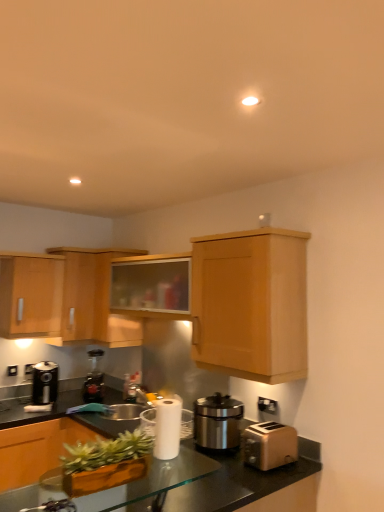
This screenshot has width=384, height=512. I want to click on translucent glass countertop at center, so pos(242,481).

The height and width of the screenshot is (512, 384). Describe the element at coordinates (269, 445) in the screenshot. I see `brown matte toaster at lower right` at that location.

Describe the element at coordinates (45, 383) in the screenshot. I see `black metallic coffee machine at left, the 1th coffee machine in the left-to-right sequence` at that location.

What do you see at coordinates (152, 285) in the screenshot? I see `wooden cabinet at upper center, which ranks as the 4th cabinetry in left-to-right order` at bounding box center [152, 285].

Find the location of a particular element. The width and height of the screenshot is (384, 512). wooden cabinet at upper center, which ranks as the 4th cabinetry in left-to-right order is located at coordinates point(152,285).

The image size is (384, 512). What do you see at coordinates (77, 293) in the screenshot? I see `wooden cabinet at upper left, which is counted as the fourth cabinetry, starting from the right` at bounding box center [77, 293].

Where is `translucent glass countertop at center`? translucent glass countertop at center is located at coordinates (242, 481).

From the image's perspective, which object appears higher, black plastic toaster at lower right or black metallic coffee machine at left, which is the 1th coffee machine in front-to-back order?

black plastic toaster at lower right, from the image's perspective.

Consider the image. Is black plastic toaster at lower right positioned with its back to black metallic coffee machine at left, the 1th coffee machine in the left-to-right sequence?

No, black metallic coffee machine at left, the 1th coffee machine in the left-to-right sequence, is not at the back of black plastic toaster at lower right.

Image resolution: width=384 pixels, height=512 pixels. Identify the location of the 2nd coffee machine below the black plastic toaster at lower right (from a real-world perspective). (45, 383).

Can you confirm if black plastic toaster at lower right is shorter than black metallic coffee machine at left, acting as the second coffee machine starting from the right?

Yes.

Is transparent glass table at lower center completely or partially inside wooden cabinet at upper center, which ranks as the 4th cabinetry in left-to-right order?

Definitely not — transparent glass table at lower center is not inside wooden cabinet at upper center, which ranks as the 4th cabinetry in left-to-right order.

From the image's perspective, relative to transparent glass table at lower center, is wooden cabinet at upper center, which ranks as the 4th cabinetry in left-to-right order, above or below?

From the image's perspective, wooden cabinet at upper center, which ranks as the 4th cabinetry in left-to-right order, appears above transparent glass table at lower center.

Is wooden cabinet at upper center, which ranks as the 4th cabinetry in left-to-right order, looking in the opposite direction of transparent glass table at lower center?

No.

Considering the sizes of objects wooden cabinet at upper center, which ranks as the second cabinetry in right-to-left order, and transparent glass table at lower center in the image provided, who is smaller, wooden cabinet at upper center, which ranks as the second cabinetry in right-to-left order, or transparent glass table at lower center?

transparent glass table at lower center is smaller.

Does satin silver sink at center have a smaller size compared to satin silver appliance at center?

Yes, satin silver sink at center is smaller than satin silver appliance at center.

Considering the points (99, 429) and (194, 415), which point is behind, point (99, 429) or point (194, 415)?

Positioned behind is point (194, 415).

Is satin silver sink at center positioned behind satin silver appliance at center?

Yes, it is.

Can you confirm if satin silver sink at center is thinner than satin silver appliance at center?

No, satin silver sink at center is not thinner than satin silver appliance at center.

Looking at this image, based on their positions, is wooden cabinet at upper center, which ranks as the 4th cabinetry in left-to-right order, located to the left or right of satin silver sink at center?

From the image, it's evident that wooden cabinet at upper center, which ranks as the 4th cabinetry in left-to-right order, is to the right of satin silver sink at center.

Between wooden cabinet at upper center, which ranks as the 4th cabinetry in left-to-right order, and satin silver sink at center, which one has more height?

wooden cabinet at upper center, which ranks as the 4th cabinetry in left-to-right order.

Is wooden cabinet at upper center, which ranks as the second cabinetry in right-to-left order, wider than satin silver sink at center?

No, wooden cabinet at upper center, which ranks as the second cabinetry in right-to-left order, is not wider than satin silver sink at center.

From the image's perspective, is wooden cabinet at upper center, which ranks as the 4th cabinetry in left-to-right order, under satin silver sink at center?

No, from the image's perspective, wooden cabinet at upper center, which ranks as the 4th cabinetry in left-to-right order, is not below satin silver sink at center.

Is translucent glass countertop at center facing away from wooden cabinet at upper center, which ranks as the 4th cabinetry in left-to-right order?

No, translucent glass countertop at center's orientation is not away from wooden cabinet at upper center, which ranks as the 4th cabinetry in left-to-right order.

Is translucent glass countertop at center smaller than wooden cabinet at upper center, which ranks as the 4th cabinetry in left-to-right order?

Actually, translucent glass countertop at center might be larger than wooden cabinet at upper center, which ranks as the 4th cabinetry in left-to-right order.

Would you say translucent glass countertop at center is a long distance from wooden cabinet at upper center, which ranks as the second cabinetry in right-to-left order?

Yes.

Can you confirm if translucent glass countertop at center is thinner than wooden cabinet at upper center, which ranks as the 4th cabinetry in left-to-right order?

No, translucent glass countertop at center is not thinner than wooden cabinet at upper center, which ranks as the 4th cabinetry in left-to-right order.

Find the location of a particular element. This screenshot has height=512, width=384. plant that is above the translucent glass countertop at center (from a real-world perspective) is located at coordinates (106, 452).

How many degrees apart are the facing directions of translucent glass countertop at center and green matte planter at lower left?

The angular difference between translucent glass countertop at center and green matte planter at lower left is 0.74 degrees.

How distant is translucent glass countertop at center from green matte planter at lower left?

translucent glass countertop at center is 14.02 inches away from green matte planter at lower left.

From a real-world perspective, between translucent glass countertop at center and green matte planter at lower left, who is vertically lower?

In real-world perspective, translucent glass countertop at center is lower.

Who is more distant, wooden cabinet at upper right, the 5th cabinetry viewed from the left, or brown matte toaster at lower right?

wooden cabinet at upper right, the 5th cabinetry viewed from the left, is more distant.

Which of these two, wooden cabinet at upper right, the 5th cabinetry viewed from the left, or brown matte toaster at lower right, is wider?

wooden cabinet at upper right, the 5th cabinetry viewed from the left.

Can you confirm if wooden cabinet at upper right, the first cabinetry positioned from the right, is taller than brown matte toaster at lower right?

Correct, wooden cabinet at upper right, the first cabinetry positioned from the right, is much taller as brown matte toaster at lower right.

Where is `the 2nd coffee machine positioned below the black plastic toaster at lower right (from the image's perspective)`? The width and height of the screenshot is (384, 512). the 2nd coffee machine positioned below the black plastic toaster at lower right (from the image's perspective) is located at coordinates (45, 383).

In order to click on cabinetry that is the 1st object to the right of the transparent glass table at lower center, starting at the anchor in this screenshot , I will do `click(152, 285)`.

From the image, which object appears to be farther from brown matte toaster at lower right, green matte planter at lower left or translucent glass countertop at center?

green matte planter at lower left lies further to brown matte toaster at lower right than the other object.

From the image, which object appears to be nearer to black plastic toaster at lower right, satin silver sink at center or transparent glass table at lower center?

Based on the image, transparent glass table at lower center appears to be nearer to black plastic toaster at lower right.

Based on their spatial positions, is light wood cabinet at left, the fifth cabinetry positioned from the right, or wooden cabinet at upper right, the 5th cabinetry viewed from the left, closer to brown matte toaster at lower right?

wooden cabinet at upper right, the 5th cabinetry viewed from the left, lies closer to brown matte toaster at lower right than the other object.

Which object lies further to the anchor point black metallic coffee machine at left, marked as the second coffee machine in a back-to-front arrangement, wooden cabinet at upper right, the first cabinetry positioned from the right, or satin silver appliance at center?

Based on the image, wooden cabinet at upper right, the first cabinetry positioned from the right, appears to be further to black metallic coffee machine at left, marked as the second coffee machine in a back-to-front arrangement.

From the image, which object appears to be farther from translucent glass countertop at center, wooden cabinet at upper center, which ranks as the second cabinetry in right-to-left order, or brown matte toaster at lower right?

Based on the image, wooden cabinet at upper center, which ranks as the second cabinetry in right-to-left order, appears to be further to translucent glass countertop at center.

From the image, which object appears to be farther from transparent glass table at lower center, wooden cabinet at upper left, marked as the second cabinetry in a left-to-right arrangement, or satin silver appliance at center?

wooden cabinet at upper left, marked as the second cabinetry in a left-to-right arrangement, lies further to transparent glass table at lower center than the other object.

Based on their spatial positions, is green matte planter at lower left or satin silver sink at center further from brown matte toaster at lower right?

green matte planter at lower left.

Considering their positions, is green matte planter at lower left positioned further to black plastic toaster at lower right than black metallic coffee machine at left, the 1th coffee machine in the left-to-right sequence?

black metallic coffee machine at left, the 1th coffee machine in the left-to-right sequence, is positioned further to the anchor black plastic toaster at lower right.

The height and width of the screenshot is (512, 384). I want to click on countertop between transparent glass table at lower center and wooden cabinet at upper center, which ranks as the 4th cabinetry in left-to-right order, along the z-axis, so click(x=242, y=481).

Where is `electric outlet between green matte planter at lower left and wooden cabinet at upper center, marked as the 3th cabinetry in a left-to-right arrangement, along the z-axis`? electric outlet between green matte planter at lower left and wooden cabinet at upper center, marked as the 3th cabinetry in a left-to-right arrangement, along the z-axis is located at coordinates (267, 405).

You are a GUI agent. You are given a task and a screenshot of the screen. Output one action in this format:
    pyautogui.click(x=<x>, y=<y>)
    Task: Click on the toaster between transparent glass table at lower center and satin silver appliance at center in the front-back direction
    The image size is (384, 512).
    Given the screenshot: What is the action you would take?
    pyautogui.click(x=269, y=445)

Where is `kitchen appliance between black metallic coffee machine at left, marked as the second coffee machine in a back-to-front arrangement, and brown matte toaster at lower right from left to right`? The height and width of the screenshot is (512, 384). kitchen appliance between black metallic coffee machine at left, marked as the second coffee machine in a back-to-front arrangement, and brown matte toaster at lower right from left to right is located at coordinates [217, 422].